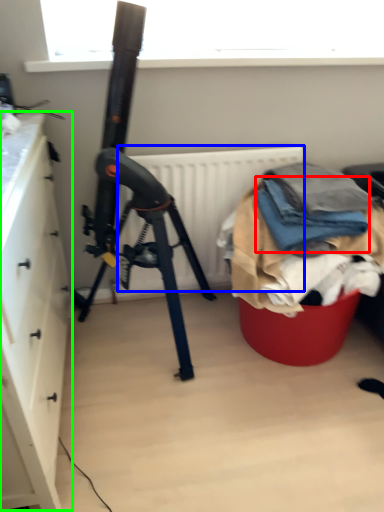
Question: Which object is positioned closest to clothing (highlighted by a red box)? Select from radiator (highlighted by a blue box) and cabinetry (highlighted by a green box).

Choices:
 (A) radiator
 (B) cabinetry

Answer: (A)